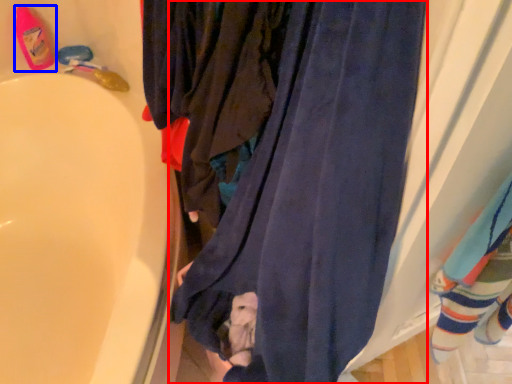
Question: Among these objects, which one is farthest to the camera, curtain (highlighted by a red box) or footwear (highlighted by a blue box)?

Choices:
 (A) curtain
 (B) footwear

Answer: (B)